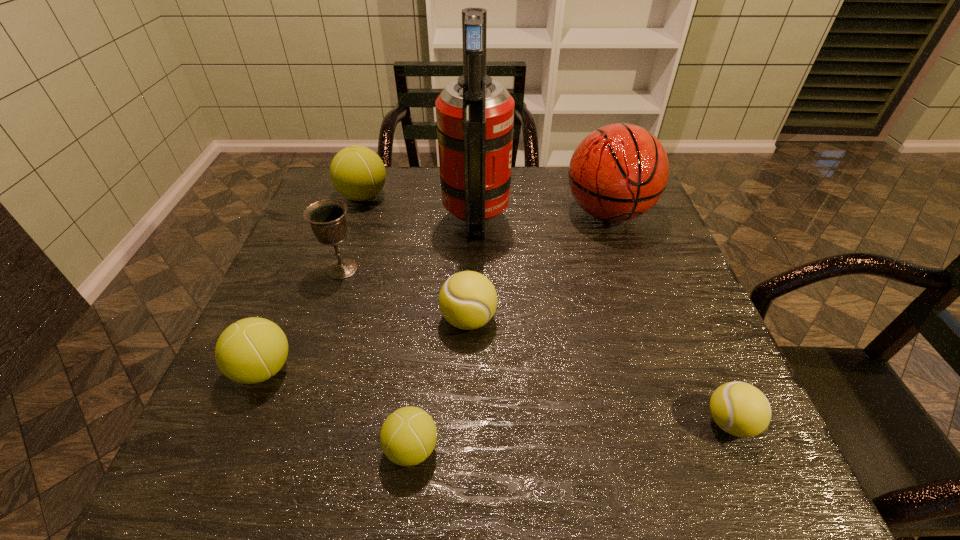
The width and height of the screenshot is (960, 540). What are the coordinates of `vacant space located 0.200m on the back of the second farthest green tennis ball` in the screenshot? It's located at (302, 276).

Locate an element on the screen. The height and width of the screenshot is (540, 960). vacant region located 0.290m on the left of the nearer yellow tennis ball is located at coordinates (538, 422).

Identify the location of vacant area situated on the back of the rightmost green tennis ball. (418, 393).

In order to click on fire extinguisher at the far edge in this screenshot , I will do `click(475, 114)`.

Find the location of a particular element. basketball that is at the far edge is located at coordinates (618, 172).

The width and height of the screenshot is (960, 540). What are the coordinates of `tennis ball that is positioned at the far edge` in the screenshot? It's located at (358, 173).

In order to click on chalice at the left edge in this screenshot , I will do `click(327, 218)`.

Find the location of a particular element. basketball located in the right edge section of the desktop is located at coordinates (618, 172).

Locate an element on the screen. The image size is (960, 540). tennis ball that is at the right edge is located at coordinates point(740,409).

The width and height of the screenshot is (960, 540). In order to click on object that is at the far left corner in this screenshot , I will do `click(358, 173)`.